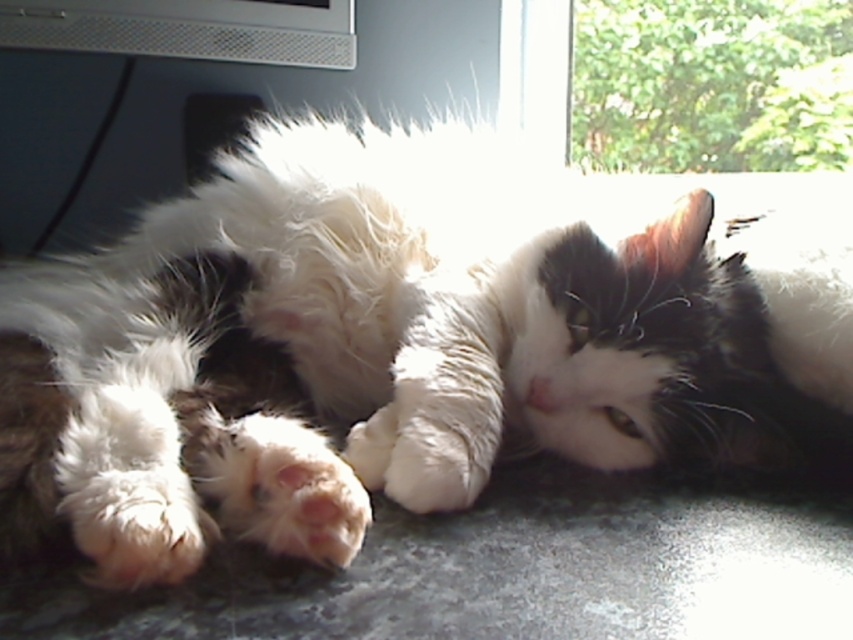
You are a photographer trying to capture the cat in the sunlight. You notice the metallic silver computer monitor at upper center and the green leafy foliage at upper right. Which object is closer to you, the photographer?

The green leafy foliage at upper right is closer to you because the metallic silver computer monitor at upper center is behind it.

You are an interior designer assessing the room layout. You notice the green leafy foliage at upper right and the metallic silver computer monitor at upper center. Which object takes up more visual space in the image?

The green leafy foliage at upper right is larger in size than the metallic silver computer monitor at upper center, so it occupies more visual space in the image.

You are a photographer trying to capture the cat in the scene. You notice two points in the image labeled as point 1 at coordinates point (822, 10) and point 2 at coordinates point (135, 33). Which point is closer to your camera lens?

Point (822, 10) is further to the viewer than point (135, 33), so the point closer to the camera lens is point (135, 33).